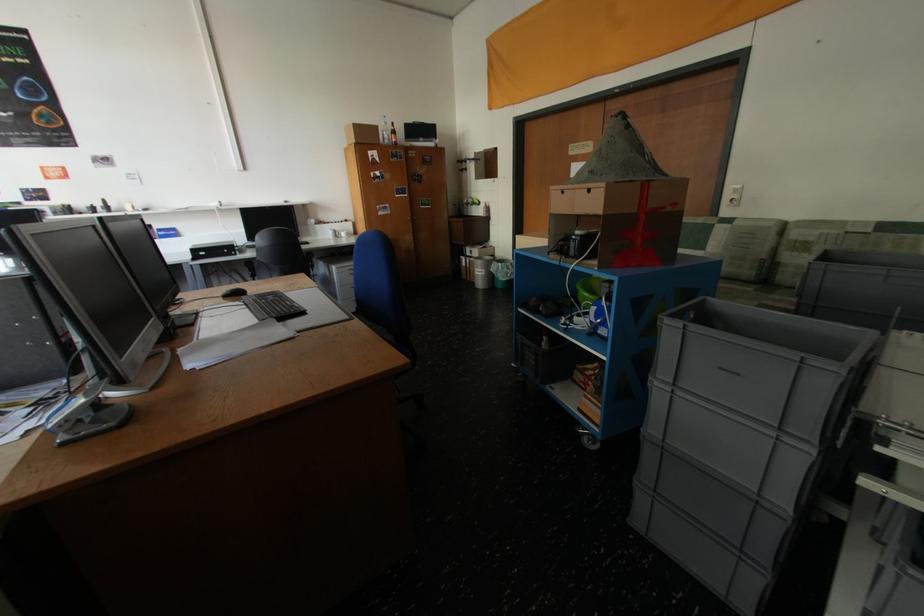
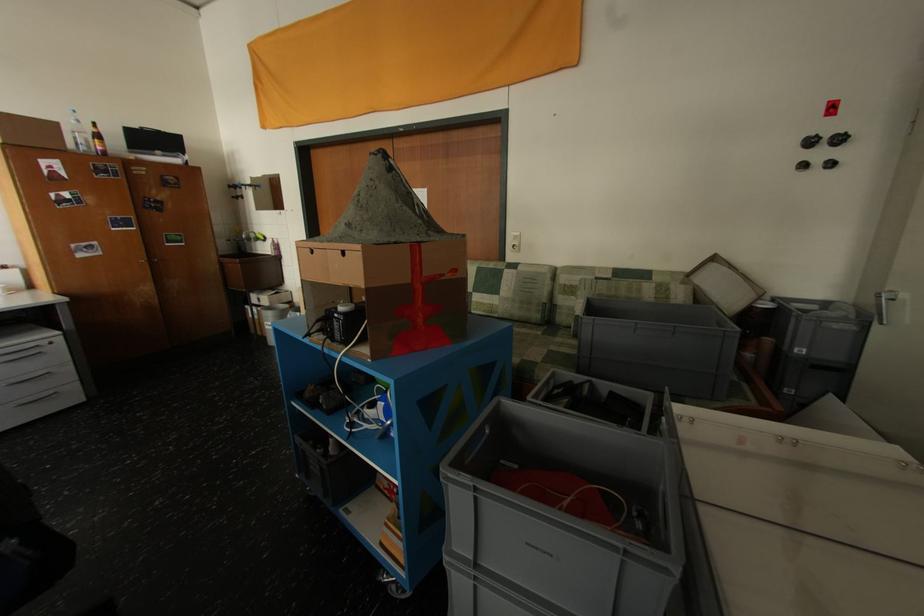
Locate, in the second image, the point that corresponds to [392,124] in the first image.

(81, 123)